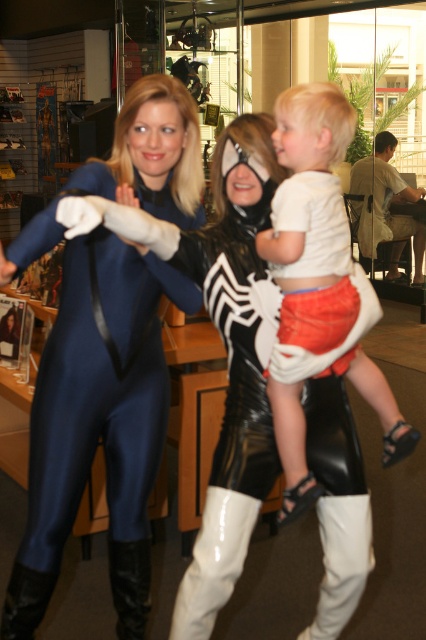
Question: Which point appears farthest from the camera in this image?

Choices:
 (A) (135, 540)
 (B) (411, 444)

Answer: (A)

Question: Is shiny blue bodysuit at center in front of white cotton shirt at upper center?

Choices:
 (A) yes
 (B) no

Answer: (A)

Question: Which object is the farthest from the white cotton shirt at upper center?

Choices:
 (A) black leather boot at lower center
 (B) shiny blue bodysuit at center

Answer: (A)

Question: Does shiny blue bodysuit at center appear under white cotton shirt at upper center?

Choices:
 (A) no
 (B) yes

Answer: (B)

Question: Observing the image, what is the correct spatial positioning of shiny blue bodysuit at center in reference to white cotton shirt at upper center?

Choices:
 (A) above
 (B) below

Answer: (B)

Question: Which point is closer to the camera?

Choices:
 (A) white cotton shirt at upper center
 (B) shiny blue bodysuit at center
 (C) black leather boot at lower center

Answer: (B)